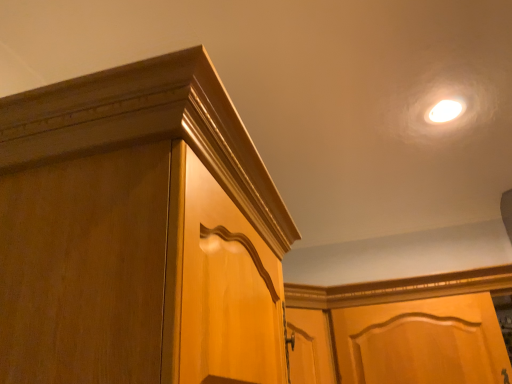
What do you see at coordinates (445, 111) in the screenshot? I see `white glossy light fixture at upper right` at bounding box center [445, 111].

Locate an element on the screen. The height and width of the screenshot is (384, 512). white glossy light fixture at upper right is located at coordinates (445, 111).

Identify the location of white glossy light fixture at upper right. (445, 111).